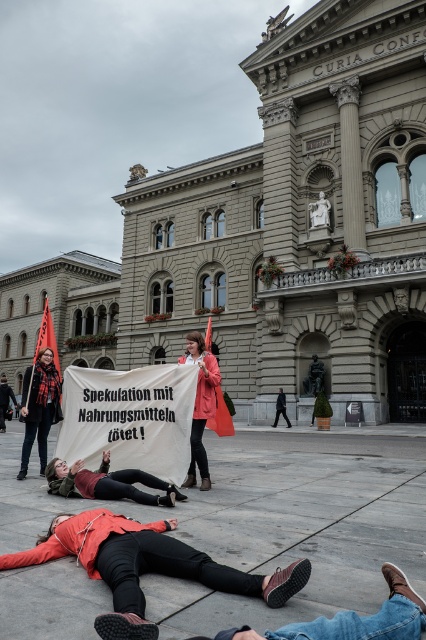
Question: Does orange fabric coat at lower center have a smaller size compared to leather jacket at lower center?

Choices:
 (A) no
 (B) yes

Answer: (A)

Question: In this image, where is orange fabric coat at lower center located relative to matte pink coat at center?

Choices:
 (A) below
 (B) above

Answer: (A)

Question: Which object appears farthest from the camera in this image?

Choices:
 (A) orange fabric coat at lower center
 (B) matte black scarf at left

Answer: (B)

Question: Is leather jacket at lower center wider than matte pink coat at center?

Choices:
 (A) yes
 (B) no

Answer: (B)

Question: Based on their relative distances, which object is farther from the leather jacket at lower center?

Choices:
 (A) matte pink coat at center
 (B) matte black scarf at left

Answer: (A)

Question: Which object is farther from the camera taking this photo?

Choices:
 (A) matte pink coat at center
 (B) orange fabric coat at lower center
 (C) matte black scarf at left

Answer: (C)